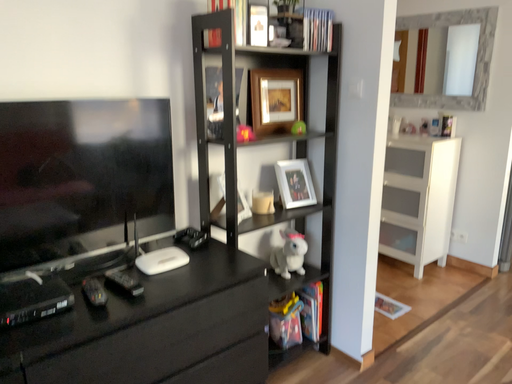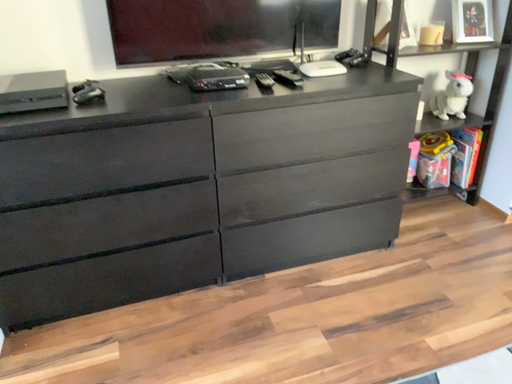
Question: Which way did the camera rotate in the video?

Choices:
 (A) rotated upward
 (B) rotated downward

Answer: (B)